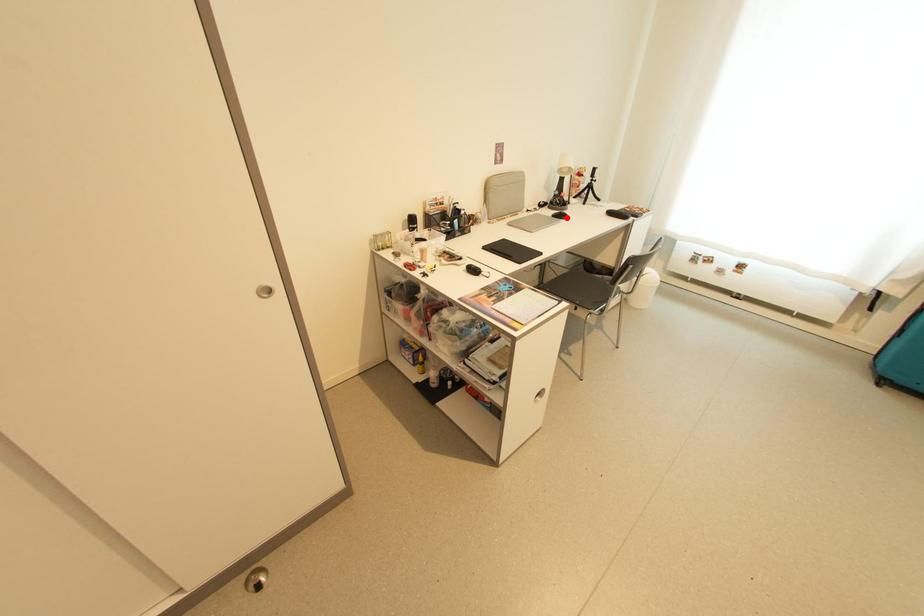
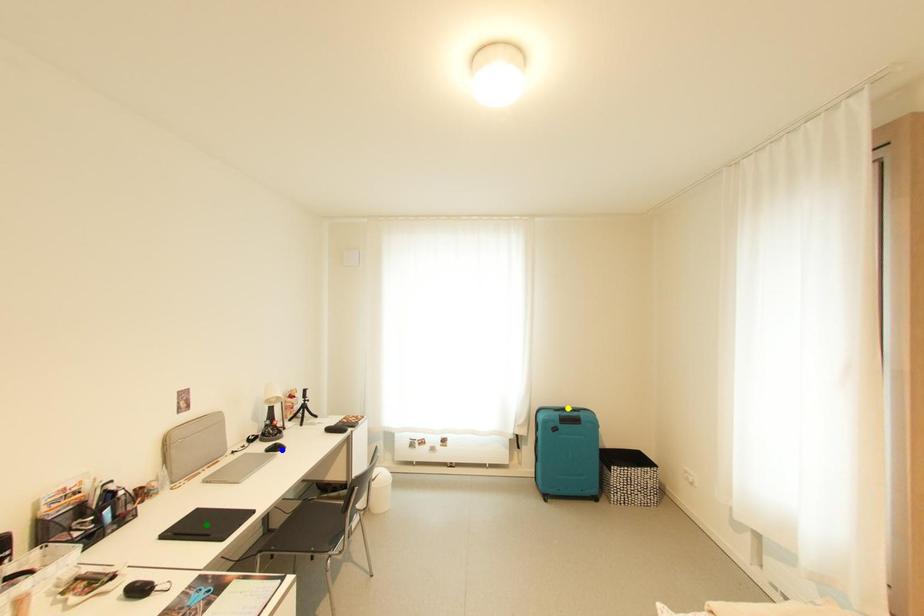
Question: I am providing you with two images of the same scene from different viewpoints. A red point is marked on the first image. You are given multiple points on the second image. Can you choose the point in image 2 that corresponds to the point in image 1?

Choices:
 (A) green point
 (B) yellow point
 (C) blue point

Answer: (C)